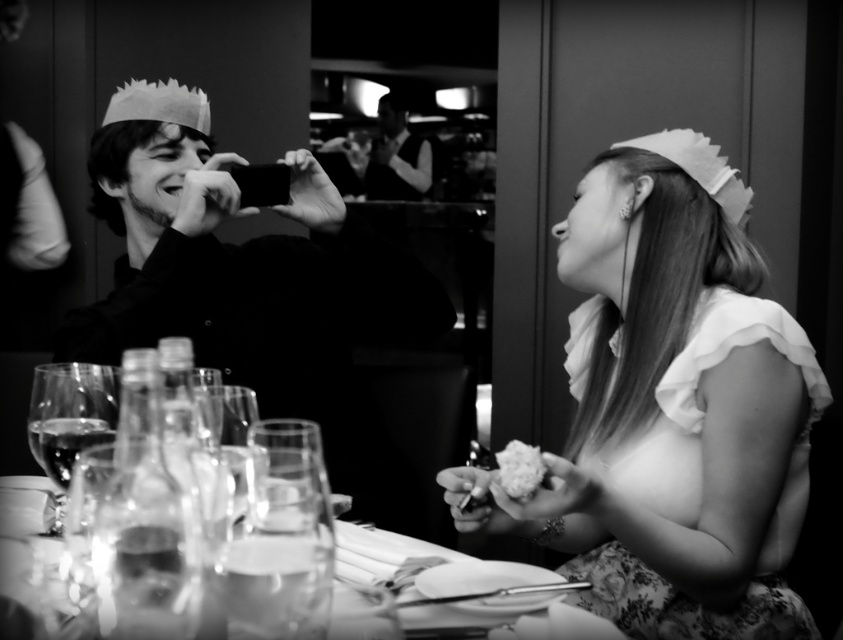
You are a server at the event and need to place a new dessert plate between the clear glassware at center and the white fluffy cake at lower center. The plate is 20 centimeters in diameter. Is there enough space between them to place the plate without moving either item?

The clear glassware at center is 60.80 centimeters from the white fluffy cake at lower center. Since the plate is only 20 centimeters in diameter, there is sufficient space between them to place the plate without moving either item.